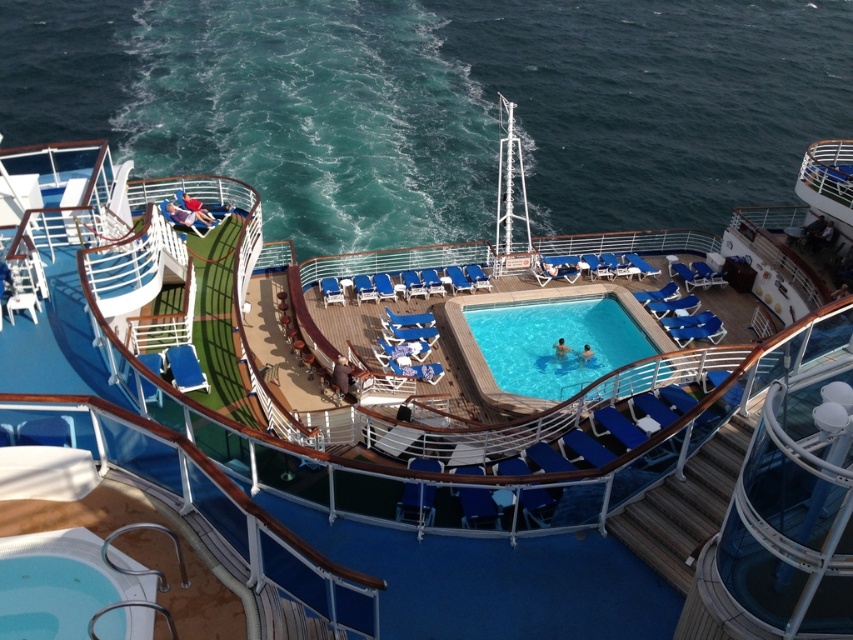
You are standing on the cruise ship deck and want to move from the point at coordinates point (317,243) to the point at coordinates point (534,324). Which direction should you move relative to your current position?

You should move forward because point (317,243) is behind point (534,324), meaning the target point is in front of your current position.